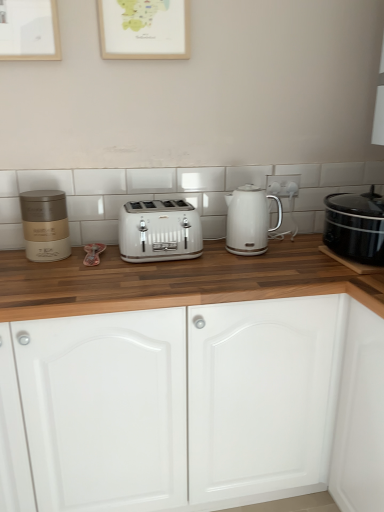
Image resolution: width=384 pixels, height=512 pixels. I want to click on vacant space situated above white glossy cabinet doors at center (from a real-world perspective), so click(x=122, y=271).